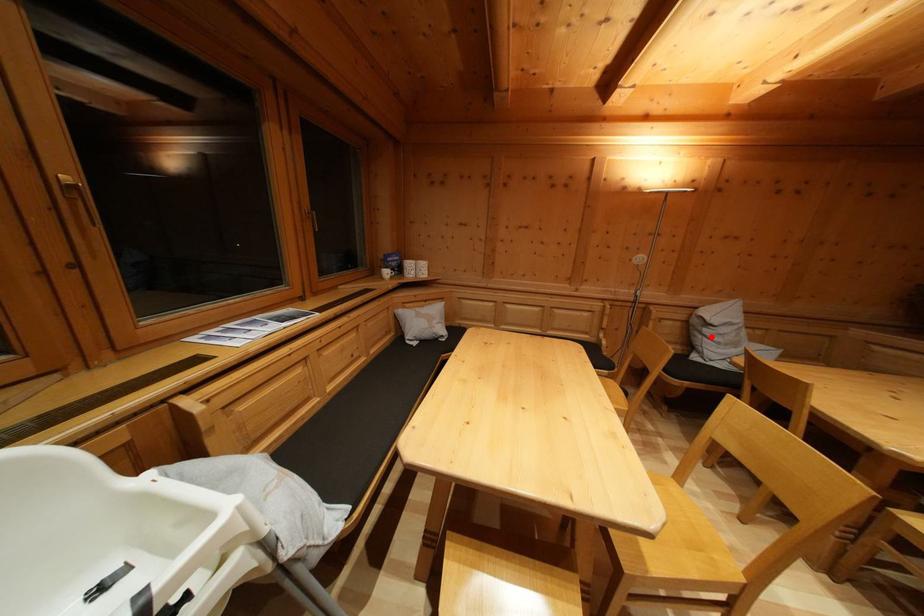
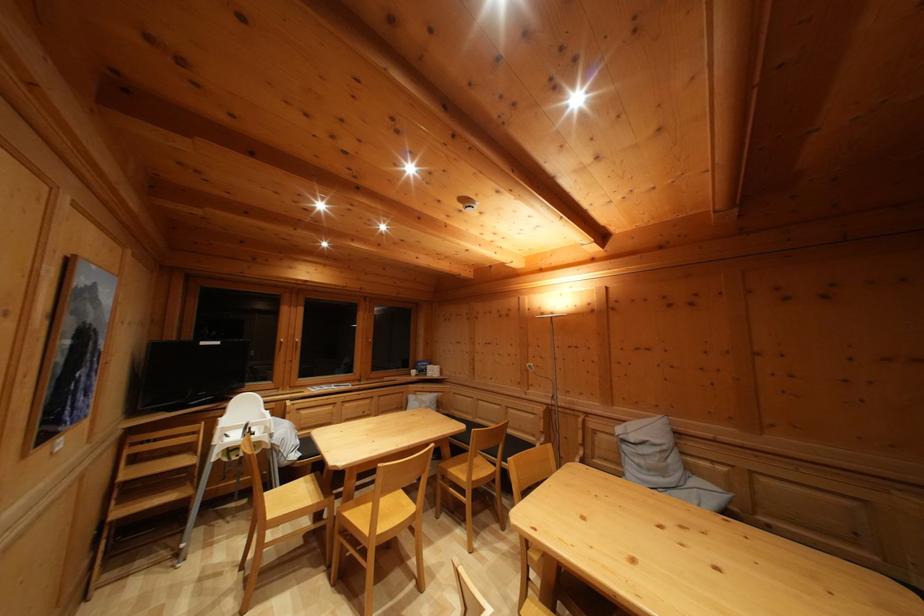
Question: I am providing you with two images of the same scene from different viewpoints. In image1, a red point is highlighted. Considering the same 3D point in image2, which of the following is correct?

Choices:
 (A) It is closer
 (B) It is farther

Answer: (B)